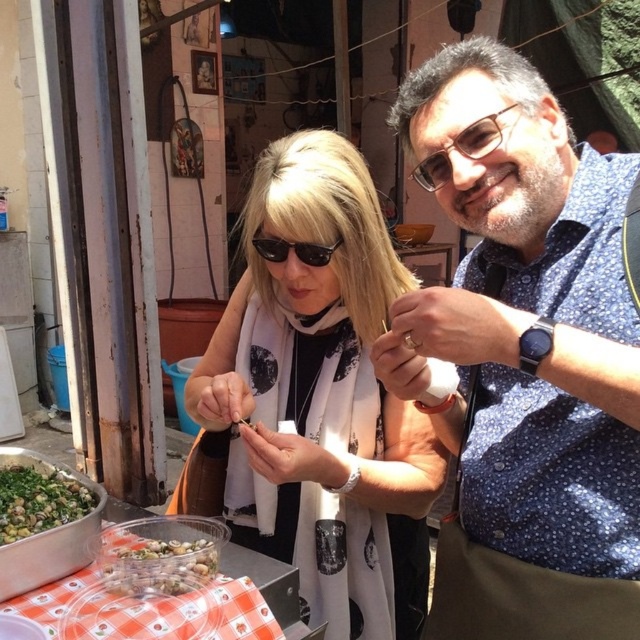
Question: Does blue dotted shirt at center appear over green matte snails at lower left?

Choices:
 (A) no
 (B) yes

Answer: (B)

Question: Does green matte snails at lower left appear under clear plastic container at lower left?

Choices:
 (A) yes
 (B) no

Answer: (B)

Question: Which point is closer to the camera?

Choices:
 (A) black plastic sunglasses at center
 (B) translucent plastic container at lower left

Answer: (B)

Question: Which object is positioned closest to the matte black glasses at upper center?

Choices:
 (A) translucent plastic container at lower left
 (B) blue dotted shirt at center
 (C) black plastic sunglasses at center

Answer: (C)

Question: Which point is closer to the camera?

Choices:
 (A) translucent plastic container at lower left
 (B) clear plastic container at lower left
 (C) green matte snails at lower left

Answer: (B)

Question: Does translucent plastic container at lower left come behind clear plastic container at lower left?

Choices:
 (A) no
 (B) yes

Answer: (B)